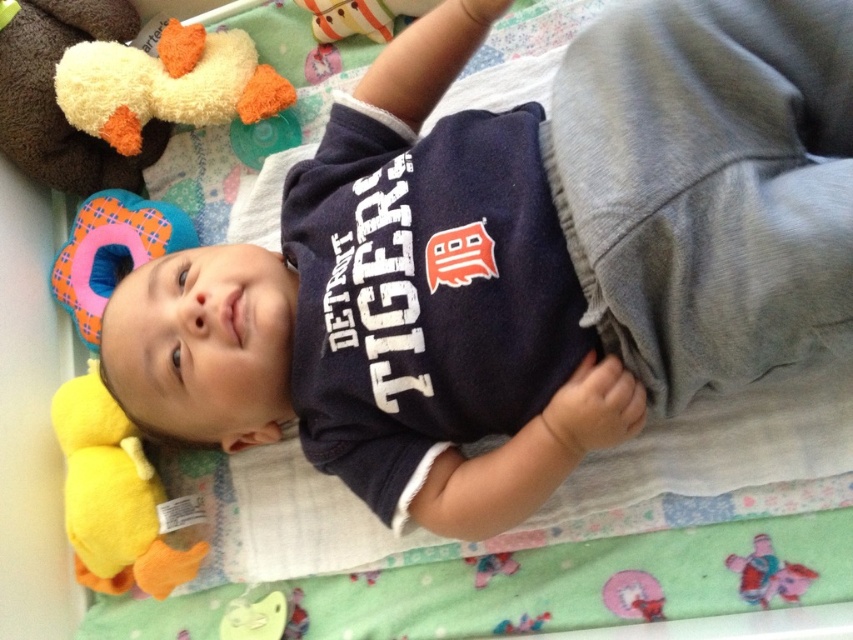
Question: Does yellow plush duck at lower left have a greater width compared to striped plush toy at upper center?

Choices:
 (A) yes
 (B) no

Answer: (A)

Question: Which object is closer to the camera taking this photo?

Choices:
 (A) striped plush toy at upper center
 (B) yellow plush duck at lower left

Answer: (B)

Question: Can you confirm if yellow plush duck at lower left is positioned above red plush elephant at lower right?

Choices:
 (A) no
 (B) yes

Answer: (B)

Question: Which object is the farthest from the red plush elephant at lower right?

Choices:
 (A) yellow plush duck at lower left
 (B) soft plush toy at upper left
 (C) striped plush toy at upper center
 (D) fluffy yellow duck at upper left

Answer: (D)

Question: Is soft plush toy at upper left closer to the viewer compared to striped plush toy at upper center?

Choices:
 (A) yes
 (B) no

Answer: (B)

Question: Which is nearer to the fluffy yellow duck at upper left?

Choices:
 (A) striped plush toy at upper center
 (B) yellow plush duck at lower left
 (C) soft plush toy at upper left
 (D) red plush elephant at lower right

Answer: (C)